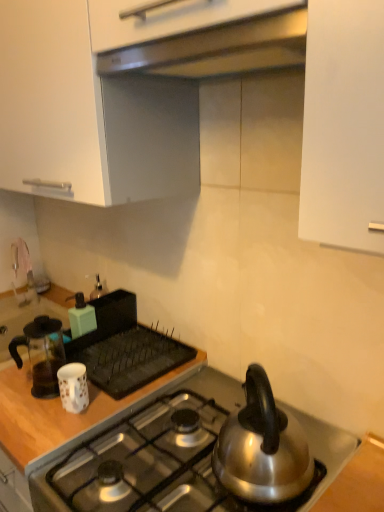
Question: Is silver metallic kettle at right bigger or smaller than woodenmaterial/texturecountertop at left?

Choices:
 (A) small
 (B) big

Answer: (A)

Question: From a real-world perspective, relative to woodenmaterial/texturecountertop at left, is silver metallic kettle at right vertically above or below?

Choices:
 (A) above
 (B) below

Answer: (A)

Question: Which object is positioned farthest from the white glossy mug at lower left, which ranks as the 1th kitchen appliance in front-to-back order?

Choices:
 (A) matte green soap dispenser at upper left, arranged as the 3th kitchen appliance when viewed from the front
 (B) transparent glass coffee pot at left, arranged as the second kitchen appliance when viewed from the back
 (C) woodenmaterial/texturecountertop at left
 (D) satin silver exhaust hood at upper center
 (E) silver metallic kettle at right

Answer: (D)

Question: Based on their relative distances, which object is nearer to the matte green soap dispenser at upper left, which ranks as the 1th kitchen appliance in back-to-front order?

Choices:
 (A) silver metallic kettle at right
 (B) white glossy mug at lower left, which ranks as the 1th kitchen appliance in front-to-back order
 (C) woodenmaterial/texturecountertop at left
 (D) satin silver exhaust hood at upper center
 (E) polished stainless steel gas stove at lower center

Answer: (B)